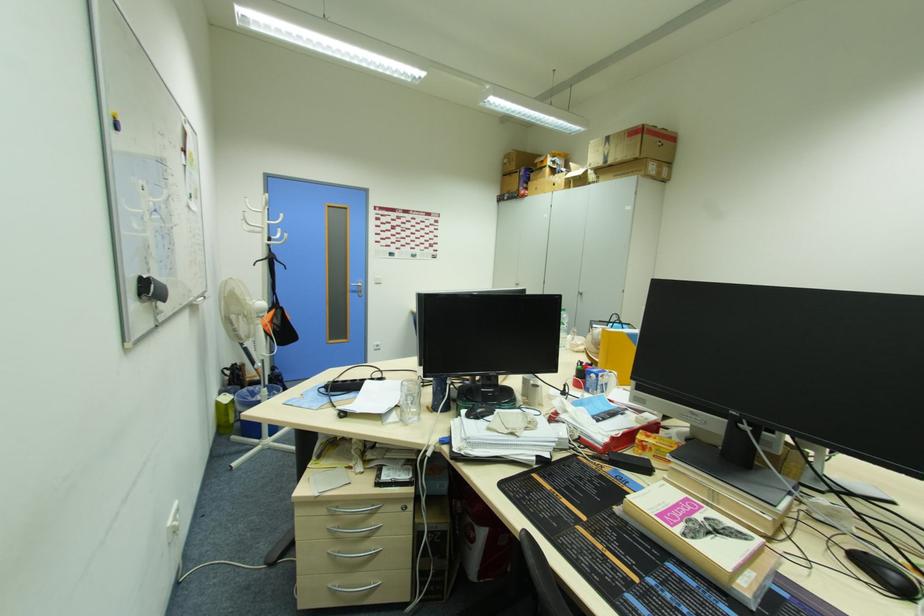
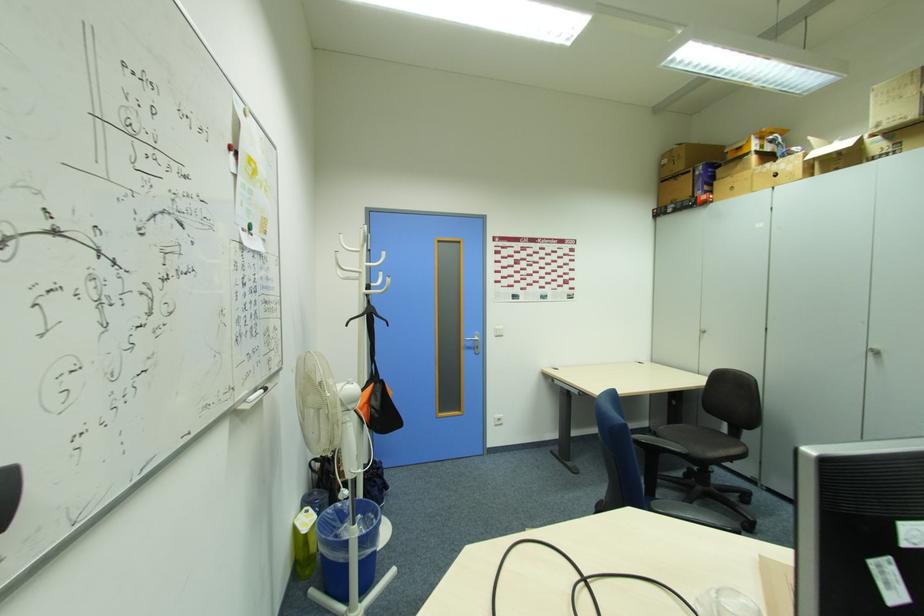
Where in the second image is the point corresponding to (x=594, y=166) from the first image?

(889, 123)